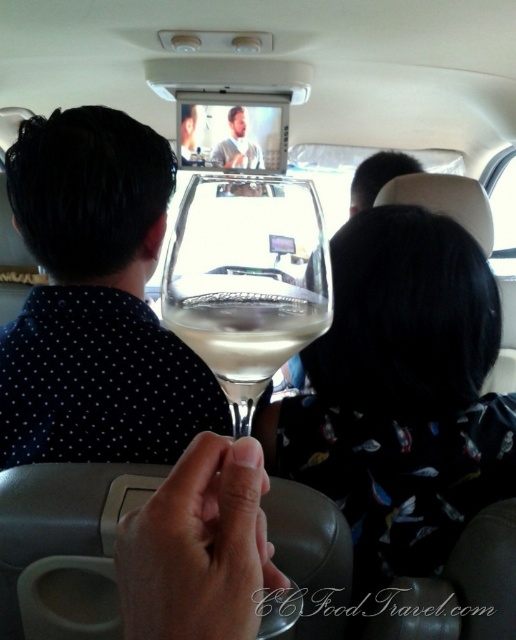
You are a passenger in the backseat of a car watching a movie. You notice the black dotted shirt at upper left and the clear glass wine glass at center. Which object is closer to you?

The clear glass wine glass at center is behind the black dotted shirt at upper left, so the black dotted shirt at upper left is closer to you.

In the scene shown: You are a passenger in the car and want to hand the clear glass wine glass at center to the person with the smooth skin face at center. Which direction should you move the wine glass to reach them?

The clear glass wine glass at center is positioned on the right side of smooth skin face at center, so you should move the wine glass to the left to reach them.

You are a passenger in the car and want to hand the clear glass wine glass at center to the person with the smooth skin face at center. Based on their positions, can you directly hand it to them without moving either object?

The clear glass wine glass at center is in front of the smooth skin face at center, so you can directly hand it to them without needing to move either object.